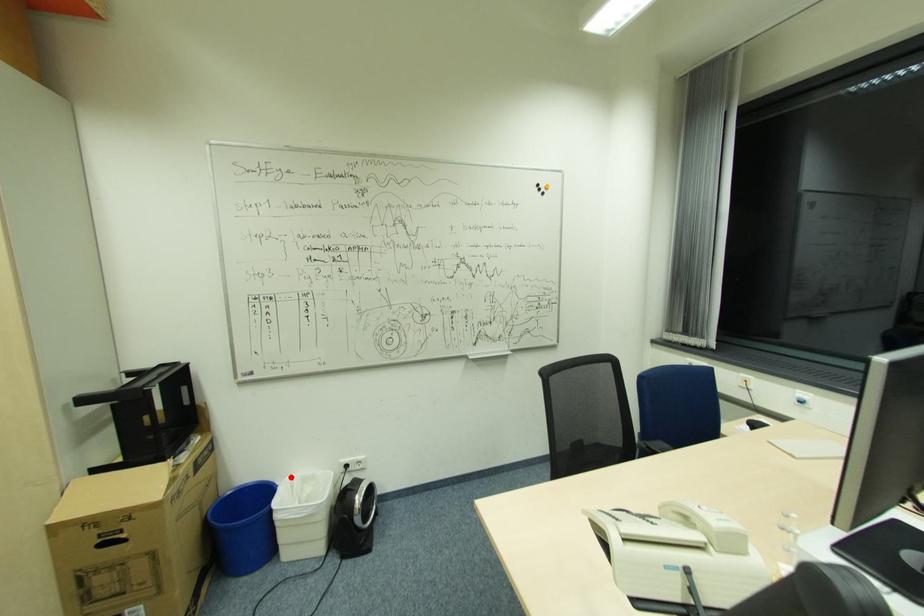
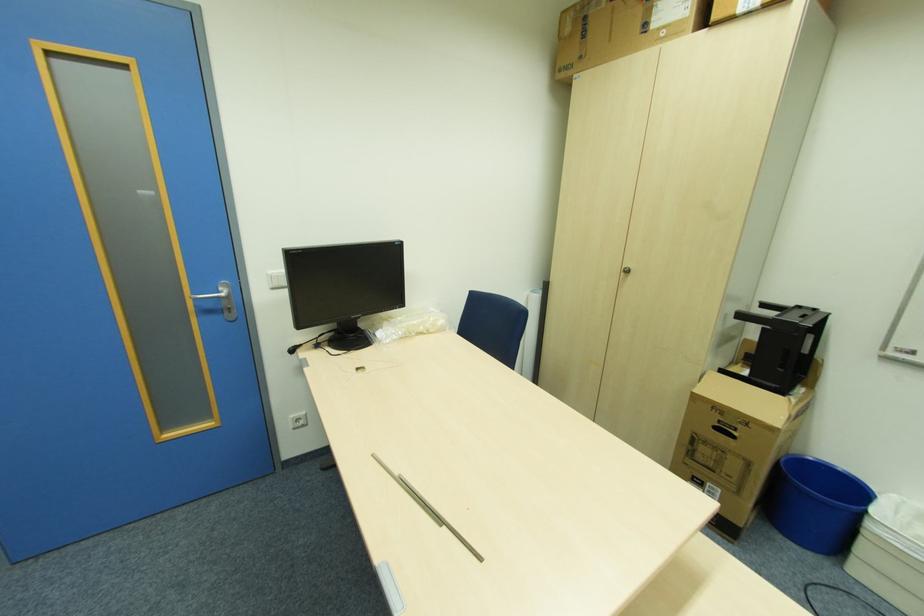
The point at the highlighted location is marked in the first image. Where is the corresponding point in the second image?

(896, 496)